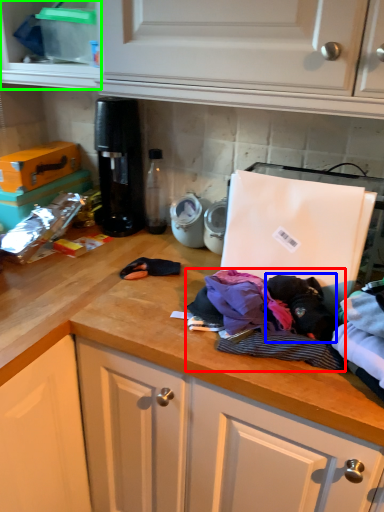
Question: Which is farther away from clothing (highlighted by a red box)? clothing (highlighted by a blue box) or cabinetry (highlighted by a green box)?

Choices:
 (A) clothing
 (B) cabinetry

Answer: (B)